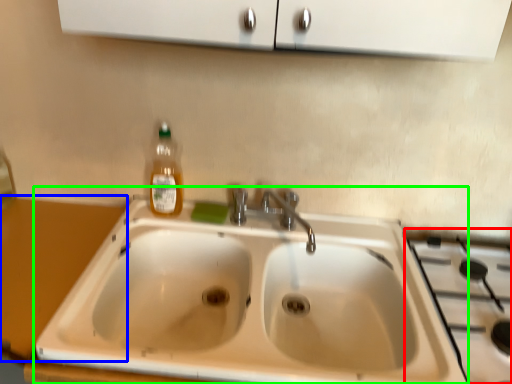
Question: Which object is positioned farthest from gas stove (highlighted by a red box)? Select from counter top (highlighted by a blue box) and sink (highlighted by a green box).

Choices:
 (A) counter top
 (B) sink

Answer: (A)